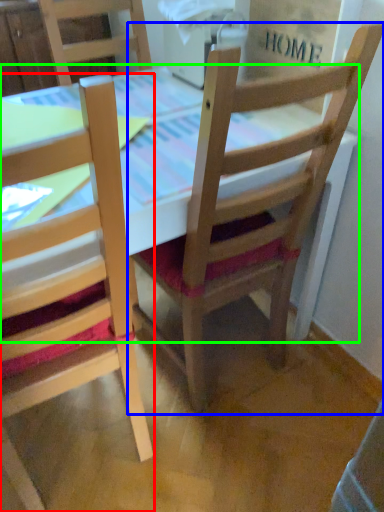
Question: Which object is the closest to the chair (highlighted by a red box)? Choose among these: chair (highlighted by a blue box) or table (highlighted by a green box).

Choices:
 (A) chair
 (B) table

Answer: (A)